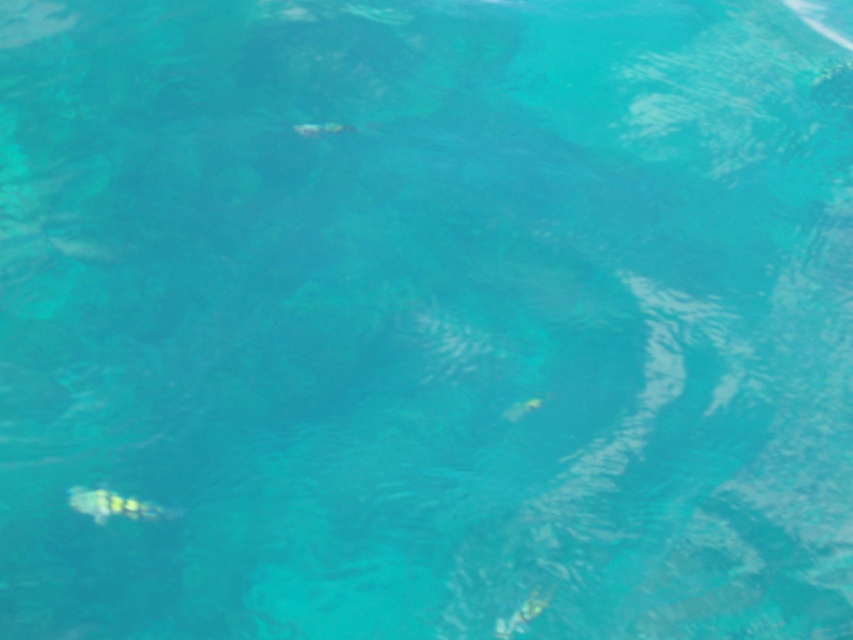
You are standing at the point labeled point (x=68, y=493) and want to take a photo of the underwater scene. The camera you are using has a maximum focus range of 10 feet. Can you capture a clear photo of the underwater scene from your current position?

The distance between point (x=68, y=493) and the camera is 8.78 feet, which is within the camera maximum focus range of 10 feet. Therefore, you can capture a clear photo of the underwater scene from your current position.

Looking at this image, you are a snorkeler observing the underwater scene. You notice a translucent yellow fish at bottom left and a translucent green fish at center. Which fish would appear closer to you based on their sizes?

The translucent yellow fish at bottom left is larger in size than the translucent green fish at center, so it would appear closer to you.